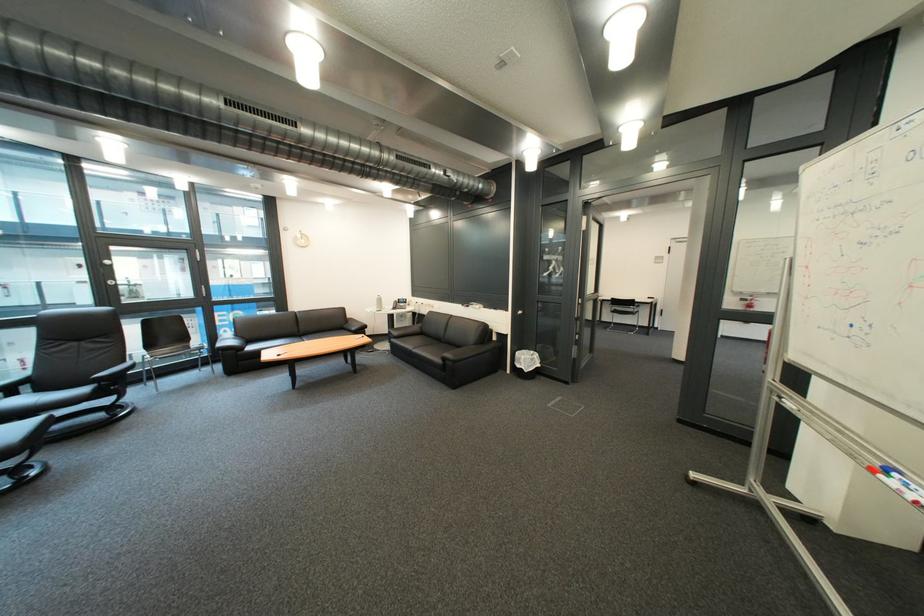
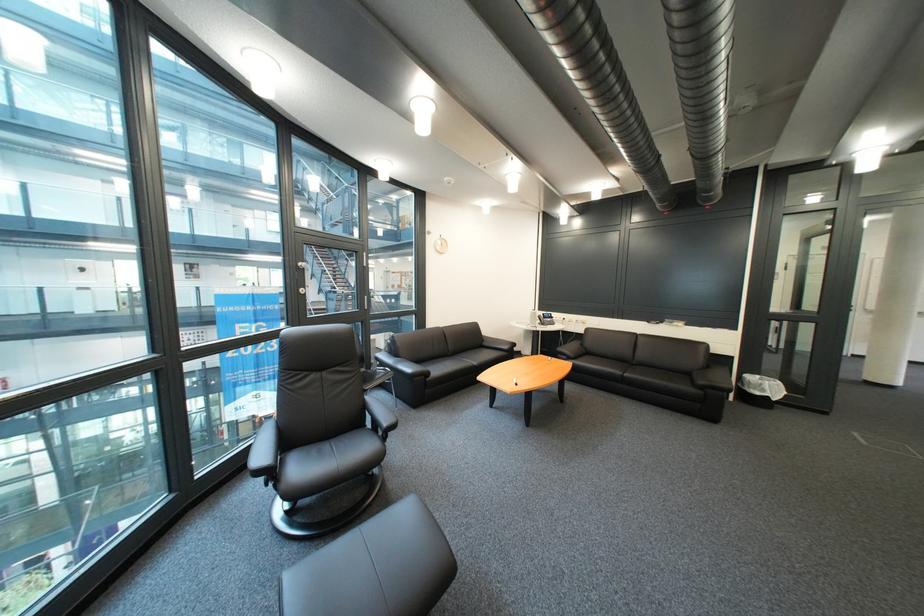
Question: What movement of the cameraman would produce the second image?

Choices:
 (A) Left
 (B) Right
 (C) Forward
 (D) Backward

Answer: (A)